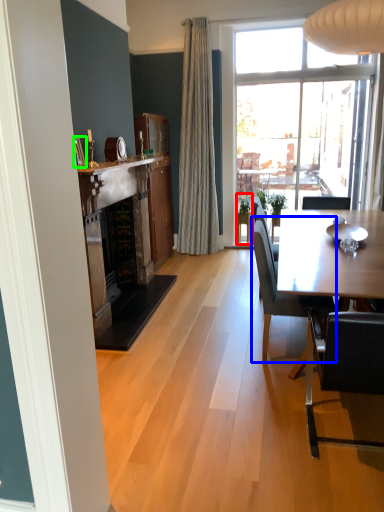
Question: Which object is positioned farthest from houseplant (highlighted by a red box)? Select from chair (highlighted by a blue box) and picture frame (highlighted by a green box).

Choices:
 (A) chair
 (B) picture frame

Answer: (B)